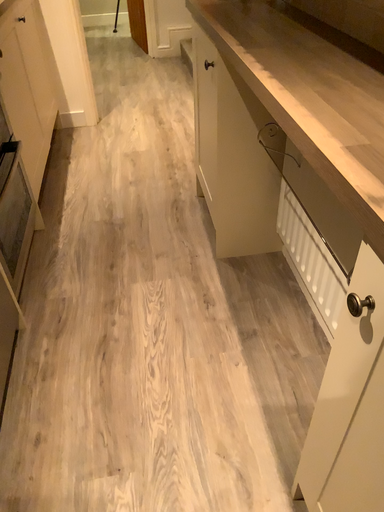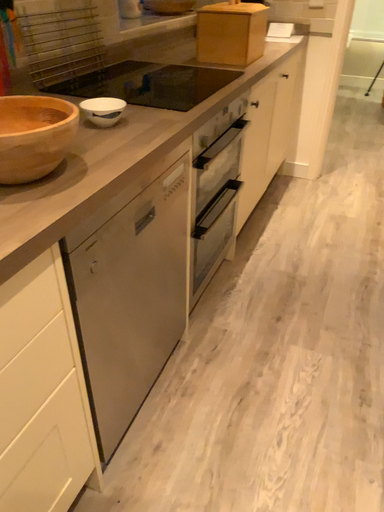
Question: Which way did the camera rotate in the video?

Choices:
 (A) rotated downward
 (B) rotated upward

Answer: (B)